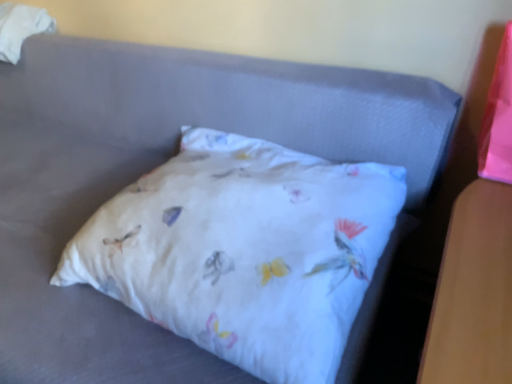
Question: In the image, is white fabric pillow at center positioned in front of or behind white fabric at upper left?

Choices:
 (A) front
 (B) behind

Answer: (A)

Question: Would you say white fabric pillow at center is inside or outside white fabric at upper left?

Choices:
 (A) inside
 (B) outside

Answer: (B)

Question: Based on their positions, is white fabric pillow at center located to the left or right of white fabric at upper left?

Choices:
 (A) left
 (B) right

Answer: (B)

Question: From the image's perspective, is white fabric at upper left located above or below white fabric pillow at center?

Choices:
 (A) above
 (B) below

Answer: (A)

Question: Is white fabric at upper left to the left or to the right of white fabric pillow at center in the image?

Choices:
 (A) left
 (B) right

Answer: (A)

Question: Is white fabric at upper left taller or shorter than white fabric pillow at center?

Choices:
 (A) short
 (B) tall

Answer: (B)

Question: From a real-world perspective, relative to white fabric pillow at center, is white fabric at upper left vertically above or below?

Choices:
 (A) below
 (B) above

Answer: (B)